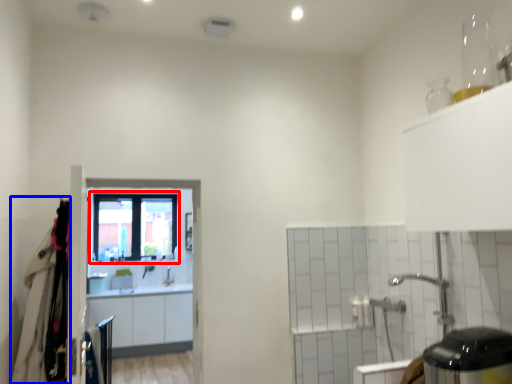
Question: Among these objects, which one is nearest to the camera, window (highlighted by a red box) or laundry (highlighted by a blue box)?

Choices:
 (A) window
 (B) laundry

Answer: (B)